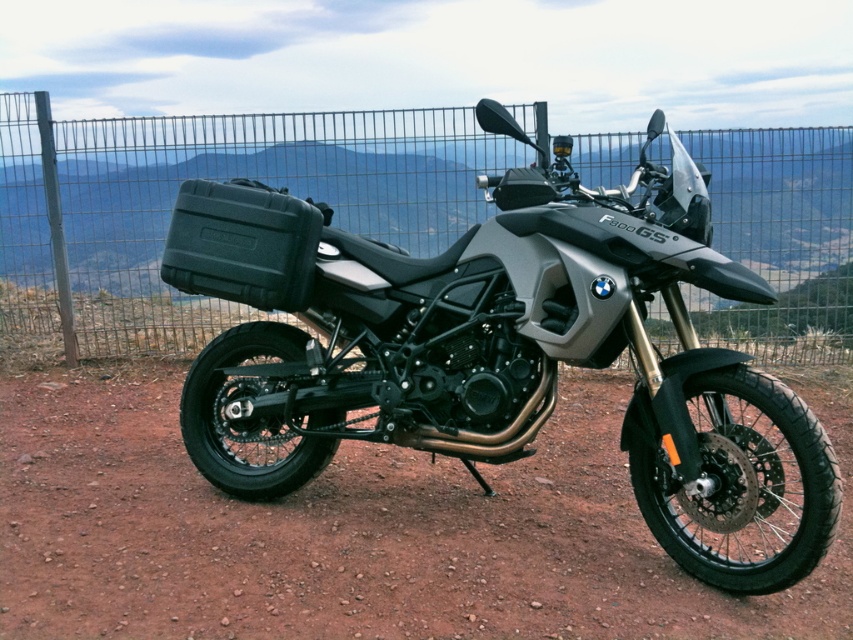
Question: Which point is closer to the camera?

Choices:
 (A) metallic wire fence at upper center
 (B) matte black motorcycle at center
 (C) brown gravel dirt track at center

Answer: (C)

Question: Estimate the real-world distances between objects in this image. Which object is closer to the metallic wire fence at upper center?

Choices:
 (A) brown gravel dirt track at center
 (B) matte black motorcycle at center

Answer: (A)

Question: Which object is farther from the camera taking this photo?

Choices:
 (A) matte black motorcycle at center
 (B) brown gravel dirt track at center

Answer: (A)

Question: Does matte black motorcycle at center appear on the right side of metallic wire fence at upper center?

Choices:
 (A) no
 (B) yes

Answer: (B)

Question: Is matte black motorcycle at center to the right of metallic wire fence at upper center from the viewer's perspective?

Choices:
 (A) no
 (B) yes

Answer: (B)

Question: Is brown gravel dirt track at center below metallic wire fence at upper center?

Choices:
 (A) no
 (B) yes

Answer: (B)